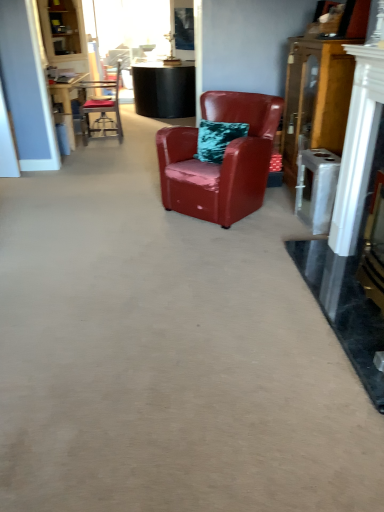
Question: Should I look upward or downward to see glossy leather armchair at center, which appears as the 2th chair when viewed from the back?

Choices:
 (A) up
 (B) down

Answer: (A)

Question: Is glossy leather armchair at center, which appears as the 2th chair when viewed from the back, facing away from metallic silver chair at upper left, which appears as the first chair when viewed from the left?

Choices:
 (A) yes
 (B) no

Answer: (B)

Question: Is glossy leather armchair at center, marked as the 2th chair in a top-to-bottom arrangement, further to the viewer compared to metallic silver chair at upper left, which is the first chair from back to front?

Choices:
 (A) yes
 (B) no

Answer: (B)

Question: Does glossy leather armchair at center, which appears as the 2th chair when viewed from the back, have a greater height compared to metallic silver chair at upper left, the 1th chair from the top?

Choices:
 (A) yes
 (B) no

Answer: (B)

Question: Is glossy leather armchair at center, which is the 1th chair in bottom-to-top order, closer to camera compared to metallic silver chair at upper left, which is the second chair in right-to-left order?

Choices:
 (A) no
 (B) yes

Answer: (B)

Question: Are glossy leather armchair at center, marked as the 2th chair in a top-to-bottom arrangement, and metallic silver chair at upper left, which appears as the first chair when viewed from the left, located far from each other?

Choices:
 (A) no
 (B) yes

Answer: (B)

Question: Does glossy leather armchair at center, positioned as the first chair in front-to-back order, appear on the right side of metallic silver chair at upper left, which is the second chair from front to back?

Choices:
 (A) no
 (B) yes

Answer: (B)

Question: Is metallic silver chair at upper left, which is the second chair from front to back, positioned with its back to glossy leather armchair at center, which is the first chair in right-to-left order?

Choices:
 (A) no
 (B) yes

Answer: (A)

Question: Is metallic silver chair at upper left, which is the second chair from front to back, thinner than glossy leather armchair at center, which is the 1th chair in bottom-to-top order?

Choices:
 (A) no
 (B) yes

Answer: (B)

Question: Considering the relative sizes of metallic silver chair at upper left, acting as the second chair starting from the bottom, and glossy leather armchair at center, the 2th chair when ordered from left to right, in the image provided, is metallic silver chair at upper left, acting as the second chair starting from the bottom, bigger than glossy leather armchair at center, the 2th chair when ordered from left to right,?

Choices:
 (A) yes
 (B) no

Answer: (B)

Question: Considering the relative sizes of metallic silver chair at upper left, acting as the second chair starting from the bottom, and glossy leather armchair at center, positioned as the first chair in front-to-back order, in the image provided, is metallic silver chair at upper left, acting as the second chair starting from the bottom, shorter than glossy leather armchair at center, positioned as the first chair in front-to-back order,?

Choices:
 (A) no
 (B) yes

Answer: (A)

Question: From a real-world perspective, is metallic silver chair at upper left, acting as the second chair starting from the bottom, below glossy leather armchair at center, which is the first chair in right-to-left order?

Choices:
 (A) yes
 (B) no

Answer: (B)

Question: Is metallic silver chair at upper left, which is the first chair from back to front, aimed at glossy leather armchair at center, which is the first chair in right-to-left order?

Choices:
 (A) yes
 (B) no

Answer: (B)

Question: Is wooden cabinet at right taller than glossy leather armchair at center, positioned as the first chair in front-to-back order?

Choices:
 (A) yes
 (B) no

Answer: (A)